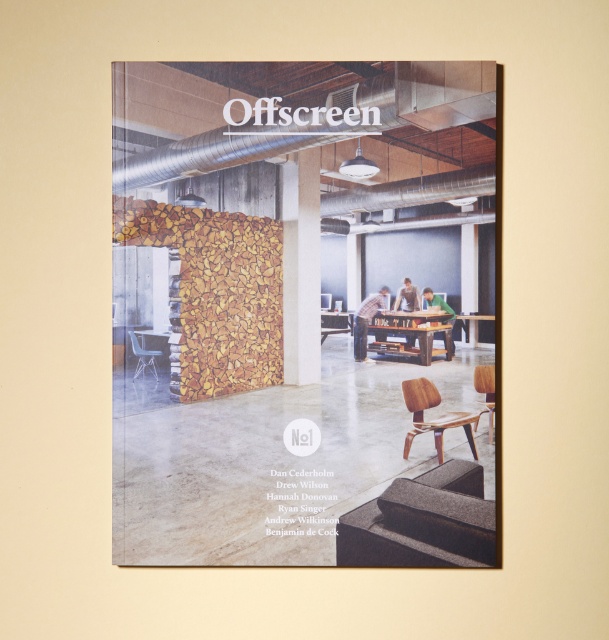
Question: Which point appears farthest from the camera in this image?

Choices:
 (A) (473, 424)
 (B) (491, 371)
 (C) (275, 449)
 (D) (158, 353)

Answer: (D)

Question: Can you confirm if matte wood poster at center is wider than wooden chair at lower right?

Choices:
 (A) no
 (B) yes

Answer: (B)

Question: Is wooden chair at right smaller than matte black chair at lower left?

Choices:
 (A) no
 (B) yes

Answer: (B)

Question: Does wooden chair at lower right appear on the left side of wooden chair at right?

Choices:
 (A) no
 (B) yes

Answer: (B)

Question: Among these points, which one is nearest to the camera?

Choices:
 (A) (233, 131)
 (B) (426, 403)
 (C) (474, 429)
 (D) (146, 356)

Answer: (A)

Question: Based on their relative distances, which object is farther from the wooden chair at lower right?

Choices:
 (A) matte black chair at lower left
 (B) matte wood poster at center

Answer: (A)